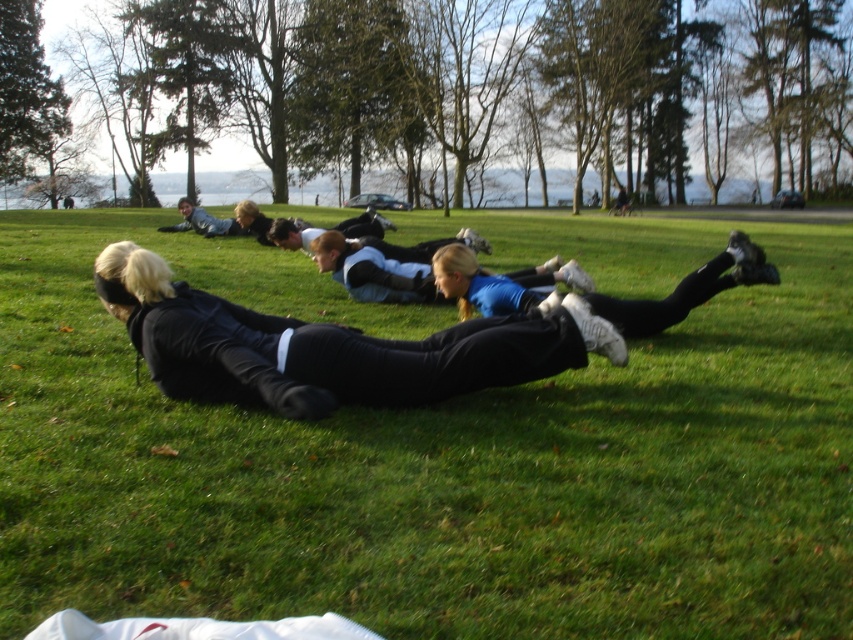
Question: Which point is farther to the camera?

Choices:
 (A) green grass at center
 (B) black matte leggings at center

Answer: (B)

Question: Does black matte leggings at center appear on the right side of blue fabric shirt at center?

Choices:
 (A) yes
 (B) no

Answer: (A)

Question: Is black matte leggings at center below blue fabric shirt at center?

Choices:
 (A) yes
 (B) no

Answer: (A)

Question: Which point is closer to the camera taking this photo?

Choices:
 (A) (534, 337)
 (B) (374, 296)
 (C) (633, 291)

Answer: (A)

Question: Can you confirm if black matte leggings at center is positioned to the right of blue fabric shirt at center?

Choices:
 (A) no
 (B) yes

Answer: (B)

Question: Which point is closer to the camera?

Choices:
 (A) (244, 374)
 (B) (508, 275)
 (C) (660, 632)

Answer: (C)